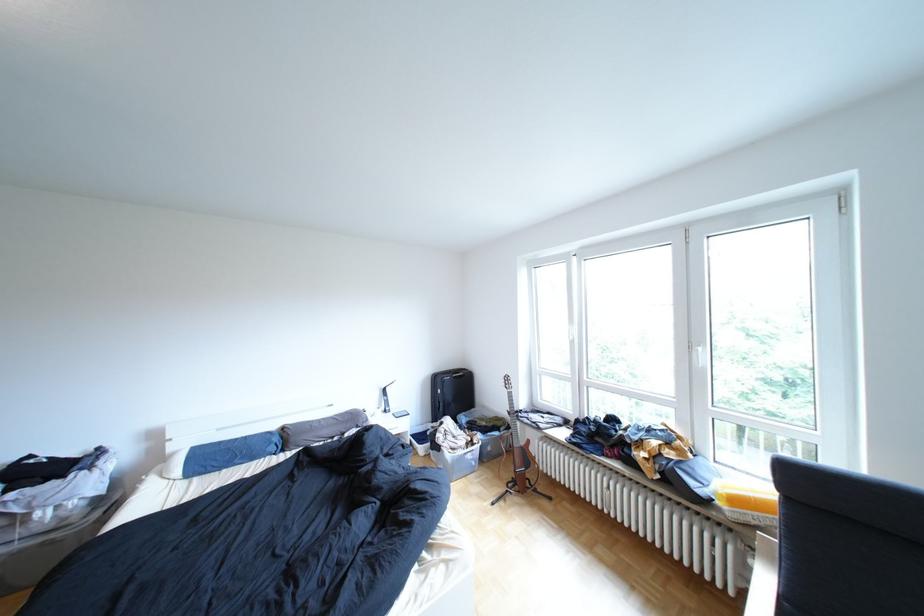
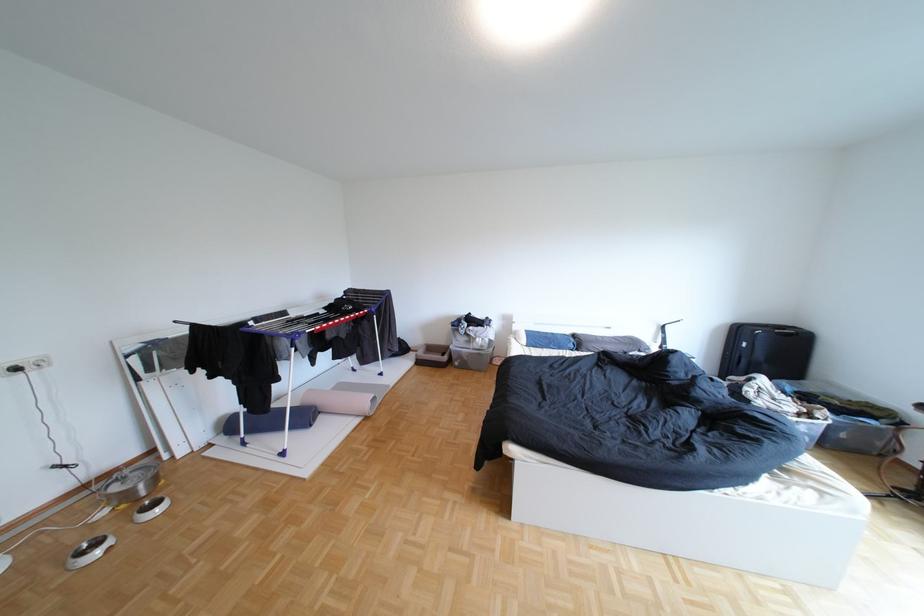
The point at (299,429) is marked in the first image. Where is the corresponding point in the second image?

(590, 336)